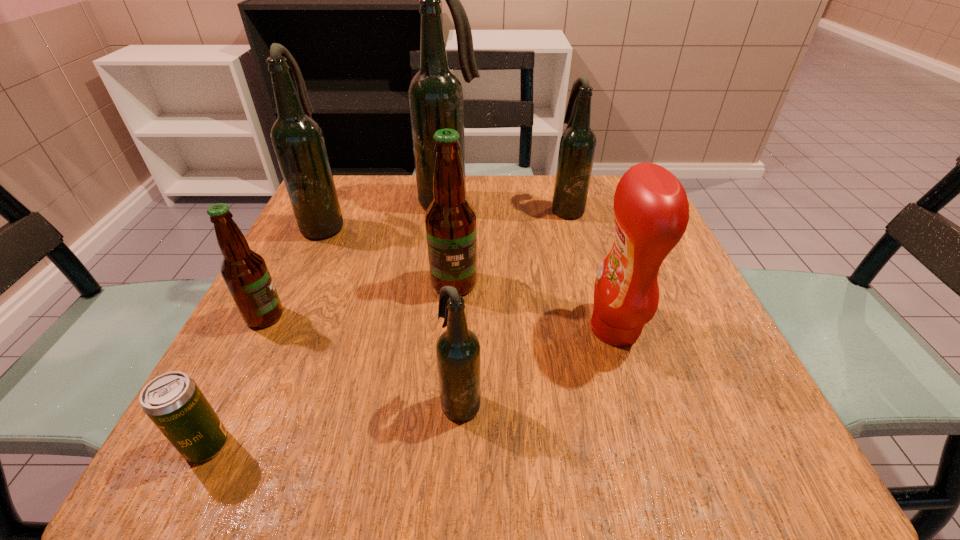
This screenshot has width=960, height=540. In order to click on object present at the far left corner in this screenshot , I will do `click(298, 141)`.

You are a GUI agent. You are given a task and a screenshot of the screen. Output one action in this format:
    pyautogui.click(x=<x>, y=<y>)
    Task: Click on the object that is positioned at the near left corner
    
    Given the screenshot: What is the action you would take?
    pyautogui.click(x=173, y=401)

This screenshot has width=960, height=540. Find the location of `object that is at the far right corner`. object that is at the far right corner is located at coordinates click(577, 147).

What are the coordinates of `vacant space at the far edge` in the screenshot? It's located at (487, 228).

Locate an element on the screen. The height and width of the screenshot is (540, 960). blank area at the left edge is located at coordinates (328, 306).

Locate an element on the screen. free space at the right edge of the desktop is located at coordinates (697, 301).

At what (x,y) coordinates should I click in order to perform the action: click on free space at the far left corner of the desktop. Please return your answer as a coordinate pair (x, y). The image size is (960, 540). Looking at the image, I should click on (343, 214).

Find the location of a particular element. This screenshot has height=540, width=960. vacant space at the near left corner is located at coordinates (280, 450).

You are a GUI agent. You are given a task and a screenshot of the screen. Output one action in this format:
    pyautogui.click(x=<x>, y=<y>)
    Task: Click on the free space at the near right corner of the desktop
    This screenshot has width=960, height=540.
    Given the screenshot: What is the action you would take?
    pyautogui.click(x=747, y=427)

Identify the location of free space between the third biggest dark beer bottle and the smallest dark beer bottle. The height and width of the screenshot is (540, 960). (515, 305).